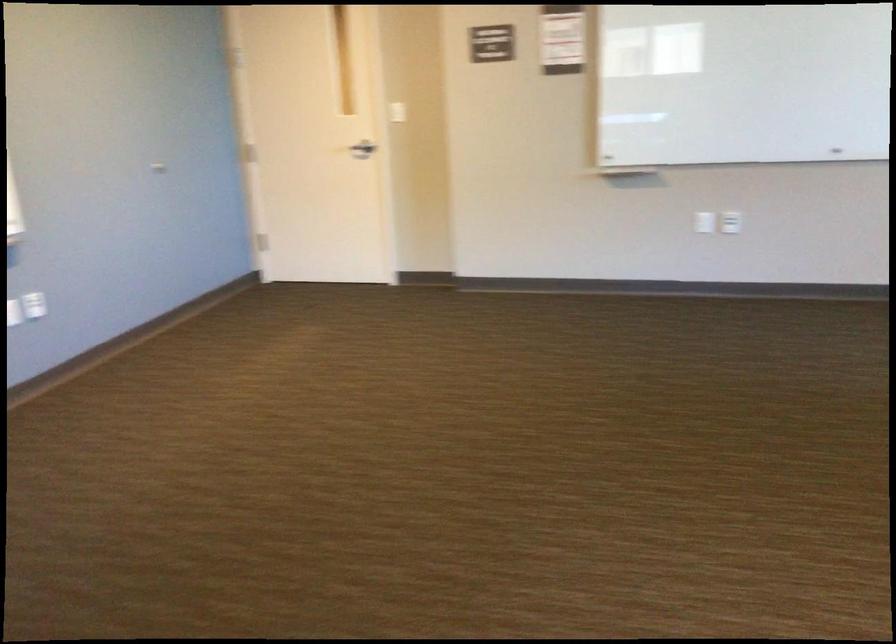
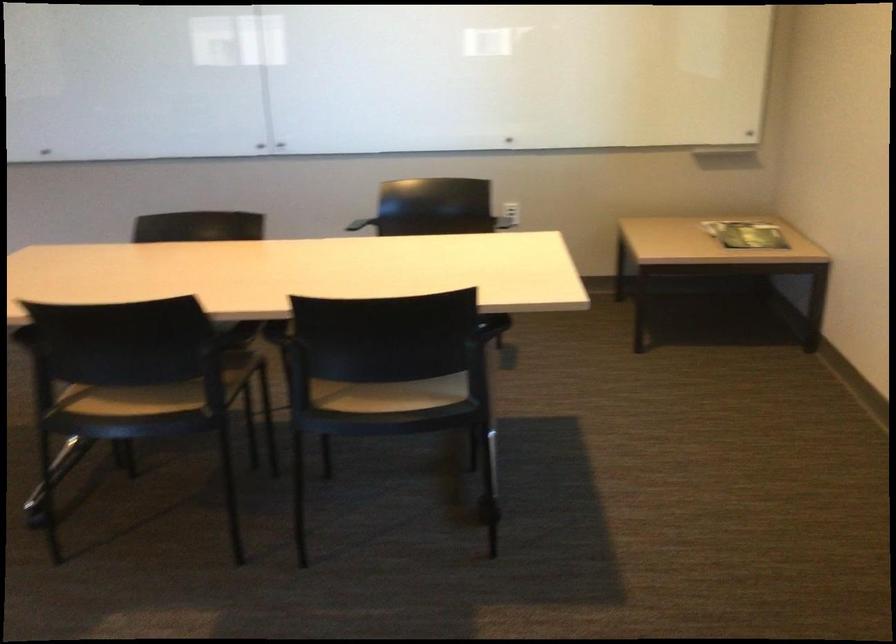
First-person continuous shooting, in which direction is the camera rotating?

The camera's rotation is toward right-down.